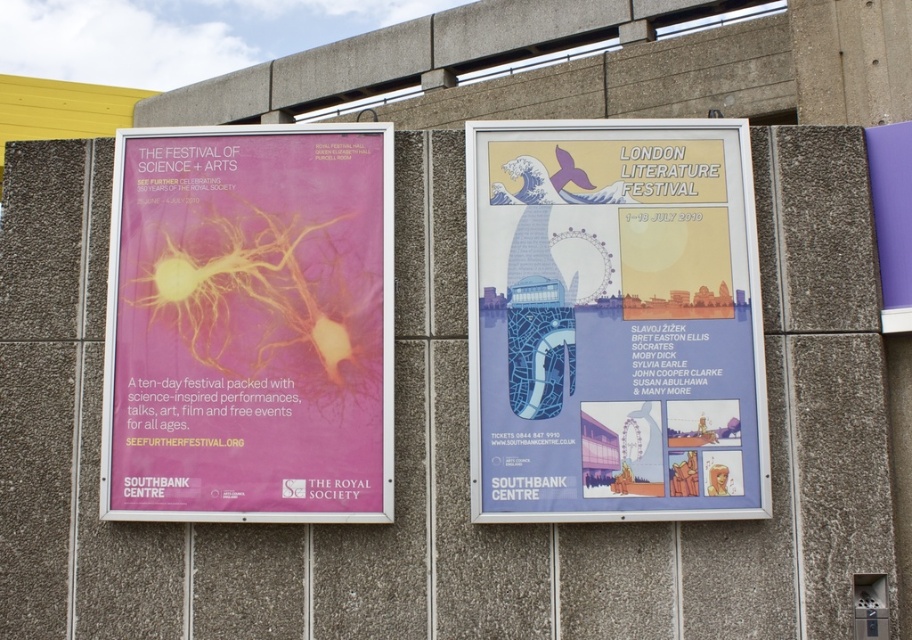
Question: Which point is closer to the camera?

Choices:
 (A) matte pink poster at left
 (B) matte blue poster at center

Answer: (B)

Question: Which point is farther to the camera?

Choices:
 (A) (719, 156)
 (B) (334, 243)

Answer: (A)

Question: Does matte blue poster at center have a lesser width compared to matte pink poster at left?

Choices:
 (A) no
 (B) yes

Answer: (A)

Question: Which object appears farthest from the camera in this image?

Choices:
 (A) matte pink poster at left
 (B) matte blue poster at center

Answer: (A)

Question: Is matte blue poster at center wider than matte pink poster at left?

Choices:
 (A) yes
 (B) no

Answer: (A)

Question: Is matte blue poster at center smaller than matte pink poster at left?

Choices:
 (A) yes
 (B) no

Answer: (B)